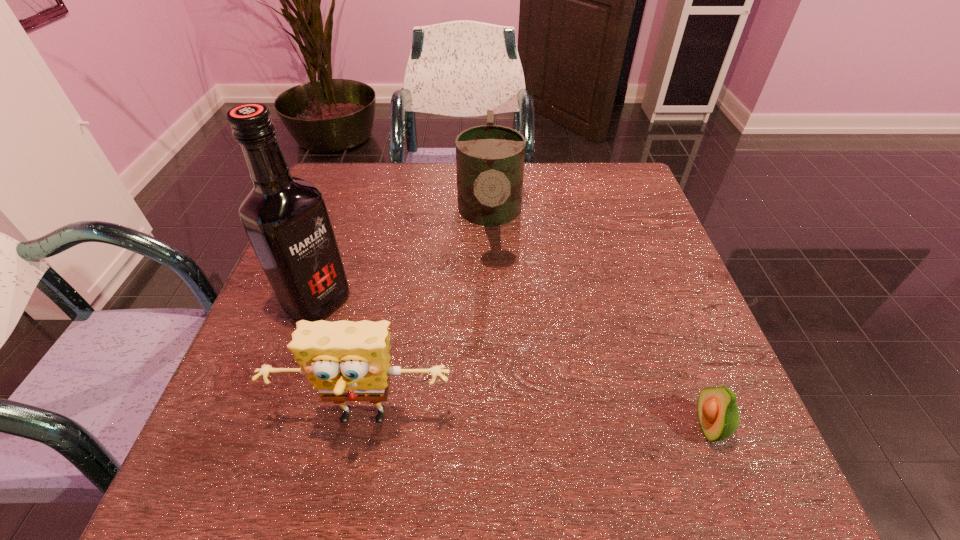
You are a GUI agent. You are given a task and a screenshot of the screen. Output one action in this format:
    pyautogui.click(x=<x>, y=<y>)
    Task: Click on the vacant space on the desktop that is between the sponge and the shortest object and is positioned on the front-facing side of the liquor
    
    Given the screenshot: What is the action you would take?
    pyautogui.click(x=532, y=423)

At what (x,y) coordinates should I click in order to perform the action: click on vacant space on the desktop that is between the sponge and the avocado and is positioned with the spout on the watering can. Please return your answer as a coordinate pair (x, y). Looking at the image, I should click on (493, 423).